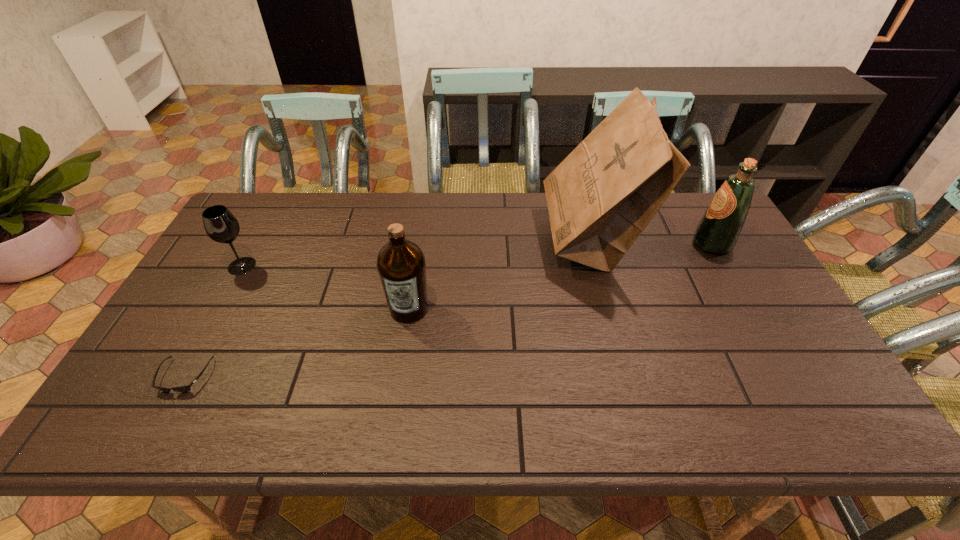
Image resolution: width=960 pixels, height=540 pixels. I want to click on vacant position in the image that satisfies the following two spatial constraints: 1. on the front-facing side of the rightmost object; 2. on the label of the third object from right to left, so click(749, 309).

Where is `vacant area that satisfies the following two spatial constraints: 1. on the front-facing side of the rightmost object; 2. on the front-facing side of the sunglasses`? The image size is (960, 540). vacant area that satisfies the following two spatial constraints: 1. on the front-facing side of the rightmost object; 2. on the front-facing side of the sunglasses is located at coordinates (786, 376).

Locate an element on the screen. This screenshot has height=540, width=960. vacant region that satisfies the following two spatial constraints: 1. on the front-facing side of the rightmost object; 2. on the label of the nearer olive oil is located at coordinates (749, 309).